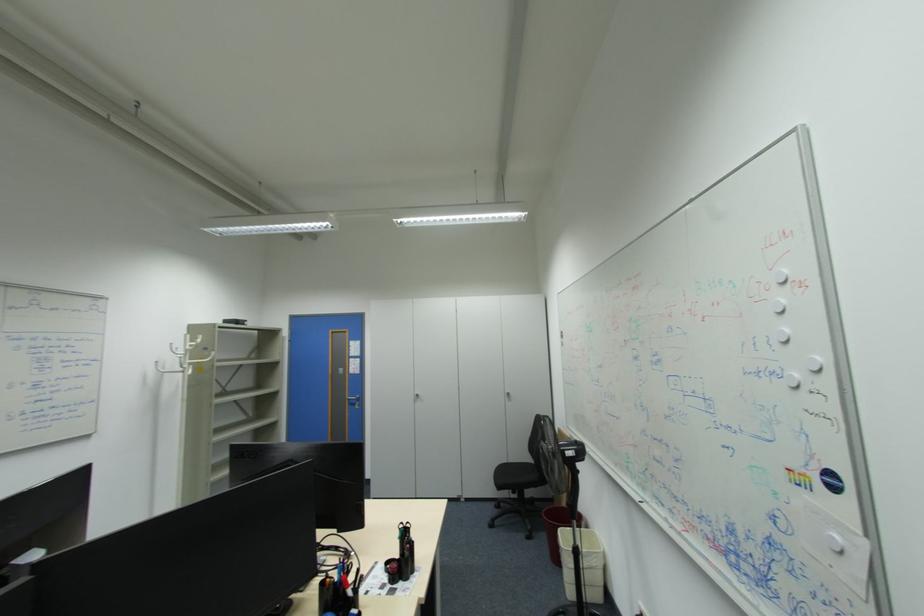
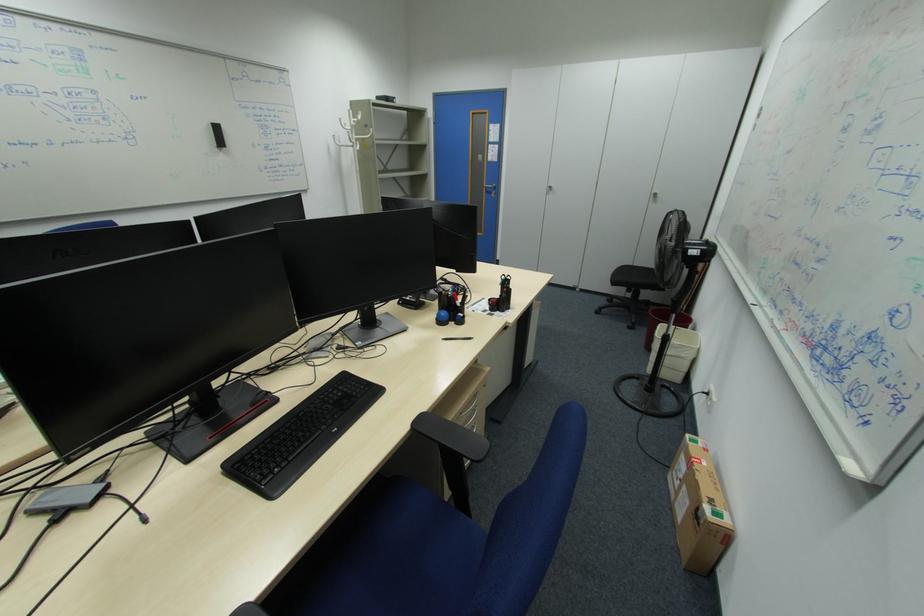
How did the camera likely rotate?

The rotation direction of the camera is left-down.